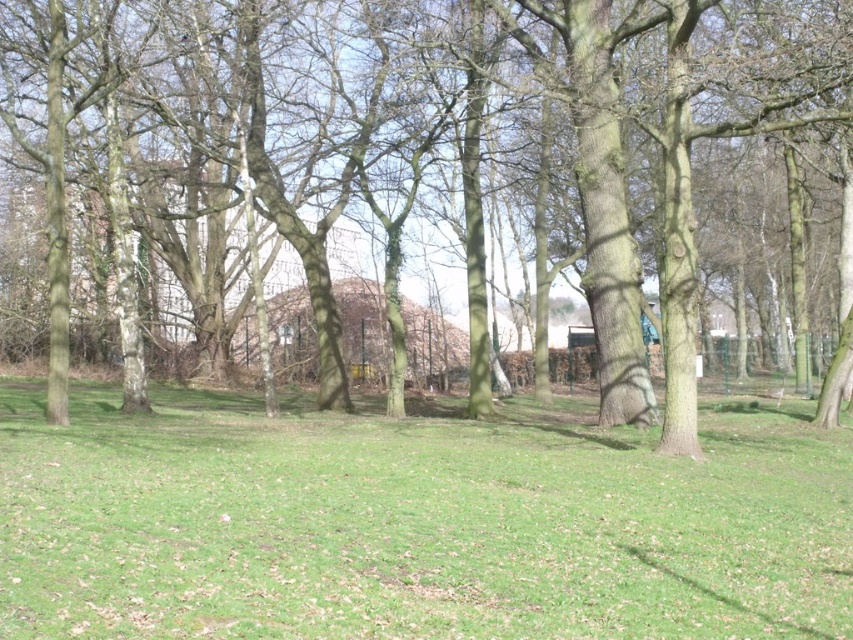
You are planning to set up a picnic in the park and have a large blanket that covers a 10 square meter area. Given the space occupied by the green grassy field at center and the brown rough tree at center, which area would be more suitable for your picnic setup?

The green grassy field at center occupies less space than the brown rough tree at center. Therefore, the brown rough tree at center has more available space and would be more suitable for setting up the picnic blanket since it occupies a larger area.

You are a gardener planning to mow the green grassy field at center and trim the brown rough tree at center. Which task requires more effort based on their sizes?

The brown rough tree at center requires more effort because it is thicker than the green grassy field at center.